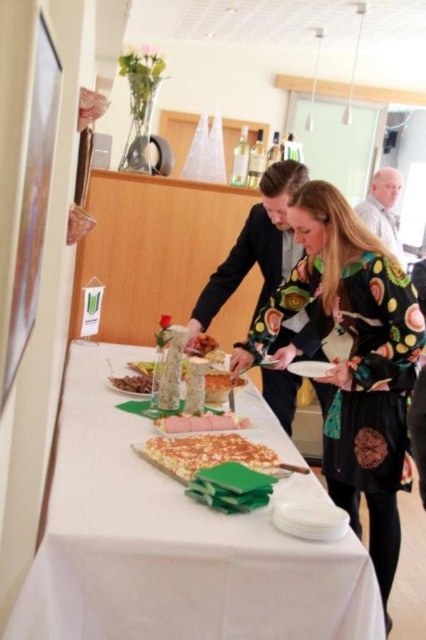
You are a guest at the event and want to choose a snack to take. You notice the black glossy suit at center and the brown crumbly at center on the table. Which one is bigger in size?

The black glossy suit at center is larger in size compared to the brown crumbly at center.